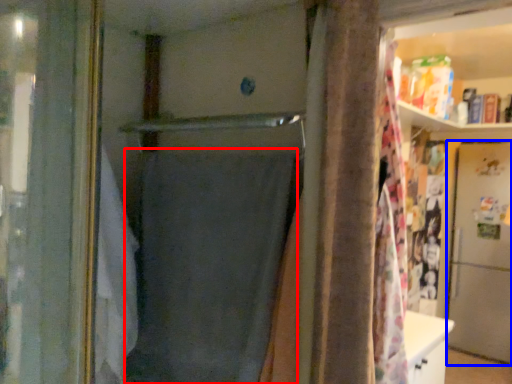
Question: Which of the following is the farthest to the observer, shower curtain (highlighted by a red box) or screen door (highlighted by a blue box)?

Choices:
 (A) shower curtain
 (B) screen door

Answer: (B)